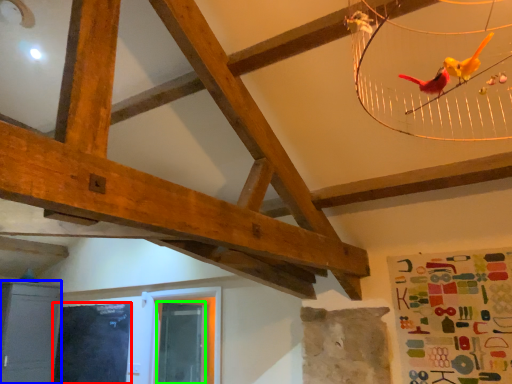
Question: Based on their relative distances, which object is nearer to window screen (highlighted by a red box)? Choose from furniture (highlighted by a blue box) and window screen (highlighted by a green box).

Choices:
 (A) furniture
 (B) window screen

Answer: (A)